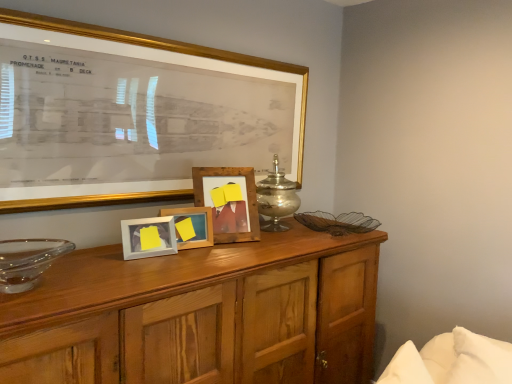
Question: From a real-world perspective, relative to transparent glass bowl at left, is wooden photo frame at center, the first picture frame when ordered from back to front, vertically above or below?

Choices:
 (A) above
 (B) below

Answer: (A)

Question: Based on their sizes in the image, would you say wooden photo frame at center, the first picture frame when ordered from back to front, is bigger or smaller than transparent glass bowl at left?

Choices:
 (A) big
 (B) small

Answer: (A)

Question: Which of these objects is positioned closest to the wooden photo frame at center, which is the 4th picture frame from front to back?

Choices:
 (A) wooden cabinet at center
 (B) silver metallic candle holder at center
 (C) transparent glass bowl at left
 (D) white soft bed at lower right
 (E) wooden photo frame at center, marked as the second picture frame in a back-to-front arrangement

Answer: (E)

Question: Estimate the real-world distances between objects in this image. Which object is farther from the gold framed picture at upper center, the 1th picture frame viewed from the front?

Choices:
 (A) white matte picture frame at center, marked as the third picture frame in a back-to-front arrangement
 (B) wooden photo frame at center, which is the 4th picture frame from front to back
 (C) transparent glass bowl at left
 (D) wooden cabinet at center
 (E) white soft bed at lower right

Answer: (E)